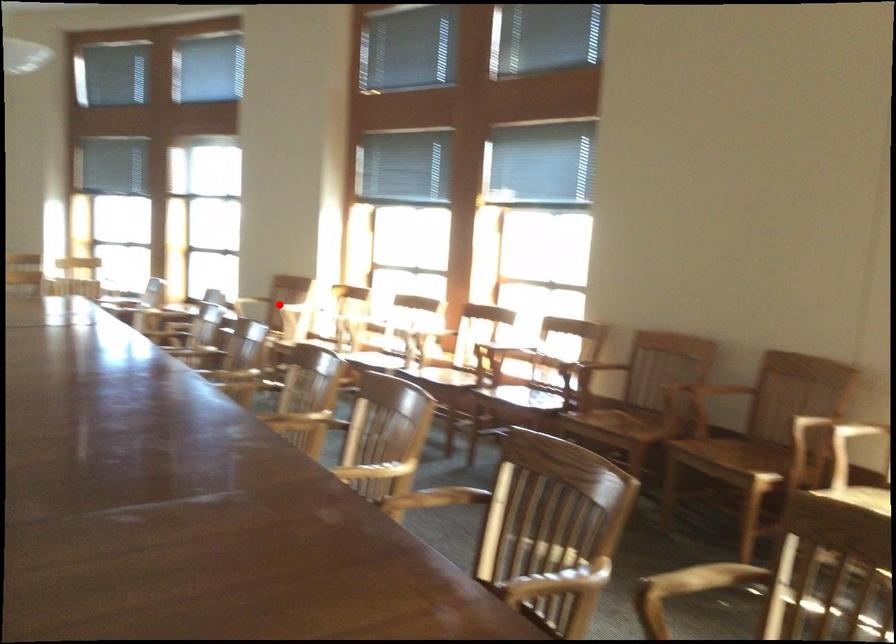
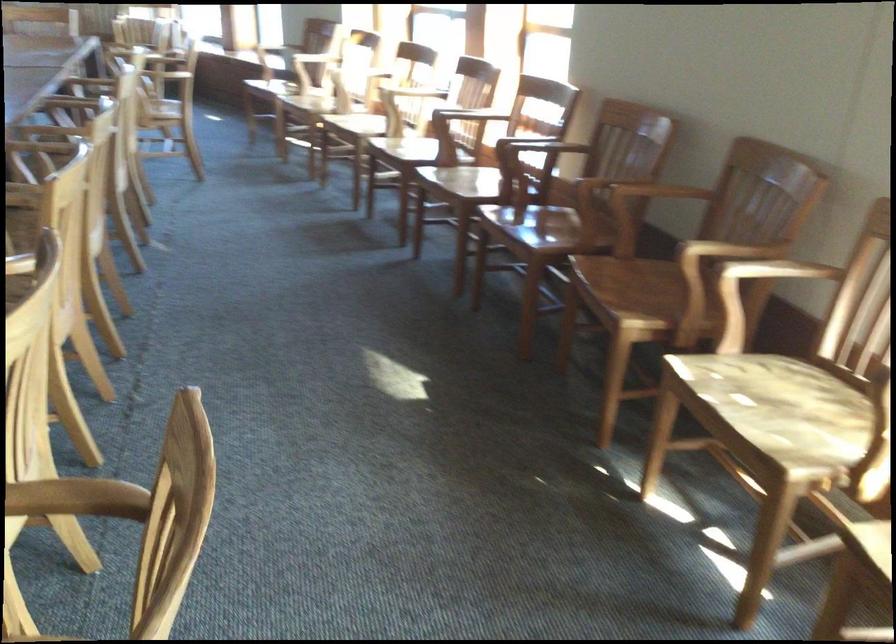
In the second image, find the point that corresponds to the highlighted location in the first image.

(312, 58)